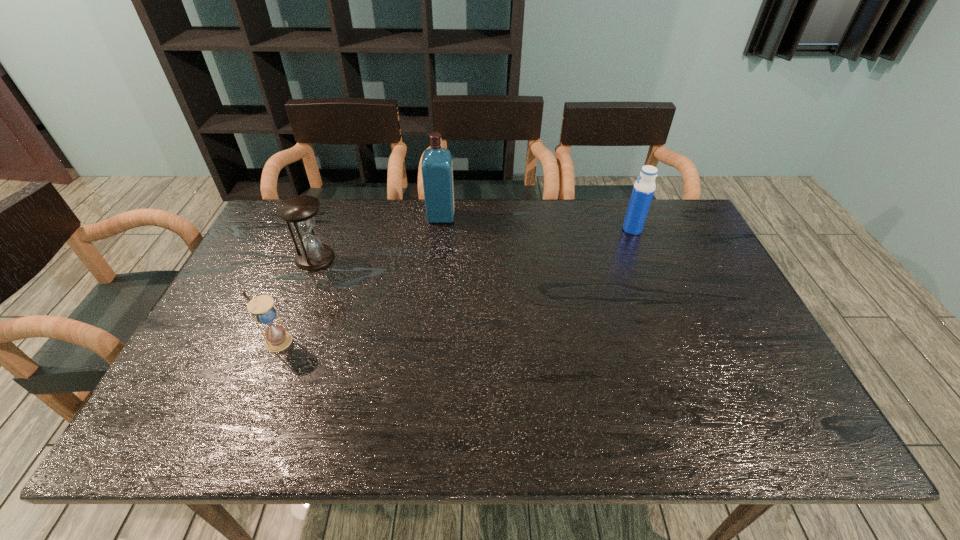
Locate which object ranks second in proximity to the shortest object. Please provide its 2D coordinates. Your answer should be formatted as a tuple, i.e. [(x, y)], where the tuple contains the x and y coordinates of a point satisfying the conditions above.

[(437, 165)]

Locate an element on the screen. This screenshot has height=540, width=960. object that stands as the third closest to the liquor is located at coordinates (643, 190).

The width and height of the screenshot is (960, 540). Find the location of `free region that satisfies the following two spatial constraints: 1. on the flat label side of the water bottle; 2. on the right side of the tallest object`. free region that satisfies the following two spatial constraints: 1. on the flat label side of the water bottle; 2. on the right side of the tallest object is located at coordinates click(440, 230).

Identify the location of vacant region that satisfies the following two spatial constraints: 1. on the flat label side of the liquor; 2. on the back side of the third shortest object. (440, 230).

Locate an element on the screen. The height and width of the screenshot is (540, 960). vacant region that satisfies the following two spatial constraints: 1. on the flat label side of the tallest object; 2. on the left side of the water bottle is located at coordinates (440, 230).